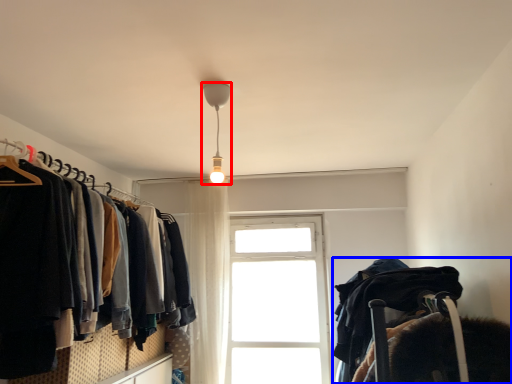
Question: Which of the following is the farthest to the observer, lamp (highlighted by a red box) or bunk bed (highlighted by a blue box)?

Choices:
 (A) lamp
 (B) bunk bed

Answer: (A)